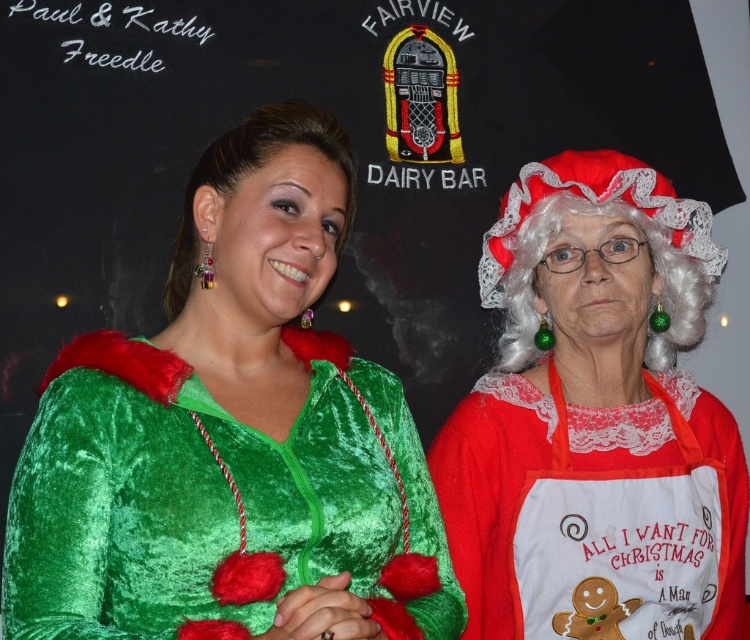
You are a photographer at the Fairview Dairy Bar event. You need to position two models wearing the velvet green dress at center and the velvet red dress at right so that they are exactly 18 inches apart for the perfect shot. Based on their current positions, do they need to move closer or farther apart?

The velvet green dress at center is currently 16.50 inches from the velvet red dress at right. To reach the desired 18 inches, they need to move farther apart by 1.5 inches.

You are a photographer setting up for a holiday photoshoot at the FAIRVIEW DAIRY BAR. You have two props available for the models to use in the shot. The velvet red dress at right and the red velvet santa hat at upper right. Which prop should you choose if you want the one that is bigger in size?

The velvet red dress at right is larger in size than the red velvet santa hat at upper right, so you should choose the velvet red dress at right as it is bigger in size.

You are a photographer standing in front of the FAIRVIEW DAIRY BAR backdrop. You need to take a photo of the velvet red dress at right. What is the minimum distance you should maintain to ensure the entire dress fits in your camera frame? The camera has a focal length of 50mm and the dress is 0.8 meters wide. Assume the camera sensor has a width of 24mm and height of 36mm.

The minimum distance required is approximately 2 meters. Using the formula distance equals sensor width multiplied by object distance divided by focal length, the calculation would be 24mm x distance divided by 50mm equals 0.8 meters. Solving for distance gives approximately 1.66 meters. However, considering the dress and viewer are 1.48 meters apart, you must maintain at least 1.48 meters to comply with the existing separation. Therefore, the minimum distance is 1.48 meters.